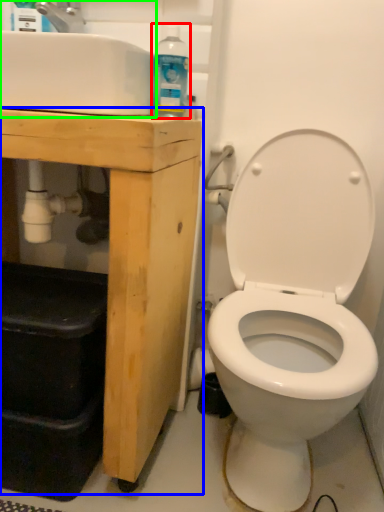
Question: Considering the real-world distances, which object is farthest from cleaning product (highlighted by a red box)? porcelain (highlighted by a blue box) or sink (highlighted by a green box)?

Choices:
 (A) porcelain
 (B) sink

Answer: (A)